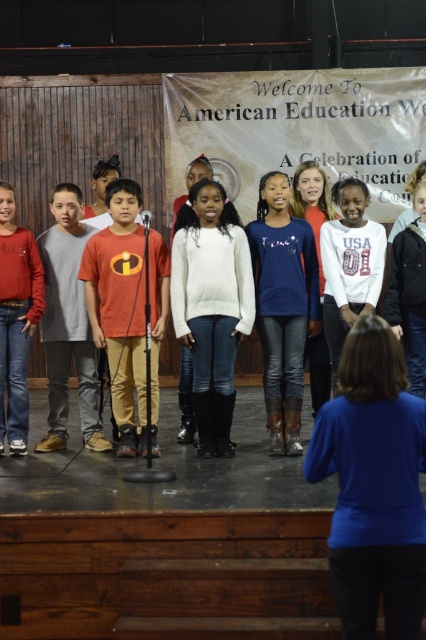
Who is positioned more to the left, blue fabric shirt at center or white sweater at center?

white sweater at center is more to the left.

Who is more forward, (331, 545) or (227, 452)?

Point (331, 545) is more forward.

I want to click on blue fabric shirt at center, so click(374, 484).

Is point (74, 209) closer to viewer compared to point (423, 376)?

No, (74, 209) is further to viewer.

Describe the element at coordinates (68, 324) in the screenshot. I see `orange cotton shirt at center` at that location.

Identify the location of orange cotton shirt at center. The height and width of the screenshot is (640, 426). (68, 324).

Consider the image. Does white sweater at center appear over matte red sweater at left?

Yes, white sweater at center is above matte red sweater at left.

Is point (195, 356) positioned after point (43, 305)?

No.

Between point (198, 333) and point (14, 250), which one is positioned in front?

Positioned in front is point (198, 333).

In order to click on white sweater at center in this screenshot , I will do `click(212, 307)`.